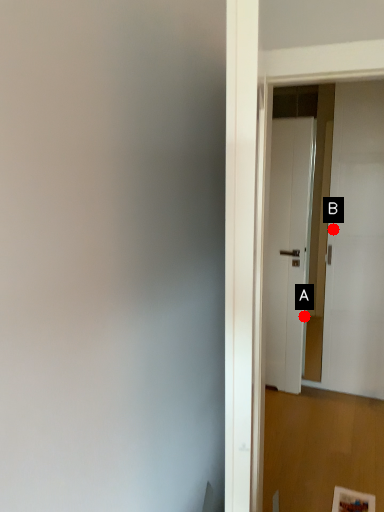
Question: Two points are circled on the image, labeled by A and B beside each circle. Which point is closer to the camera?

Choices:
 (A) A is closer
 (B) B is closer

Answer: (B)